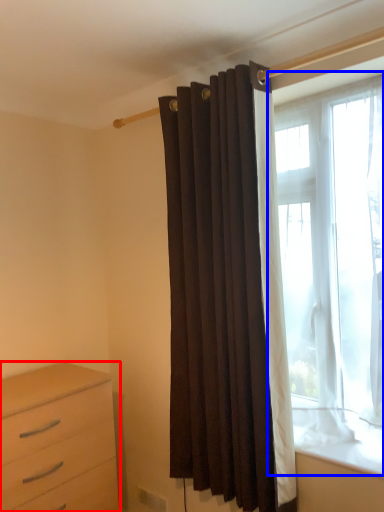
Question: Which object is further to the camera taking this photo, chest of drawers (highlighted by a red box) or window (highlighted by a blue box)?

Choices:
 (A) chest of drawers
 (B) window

Answer: (A)